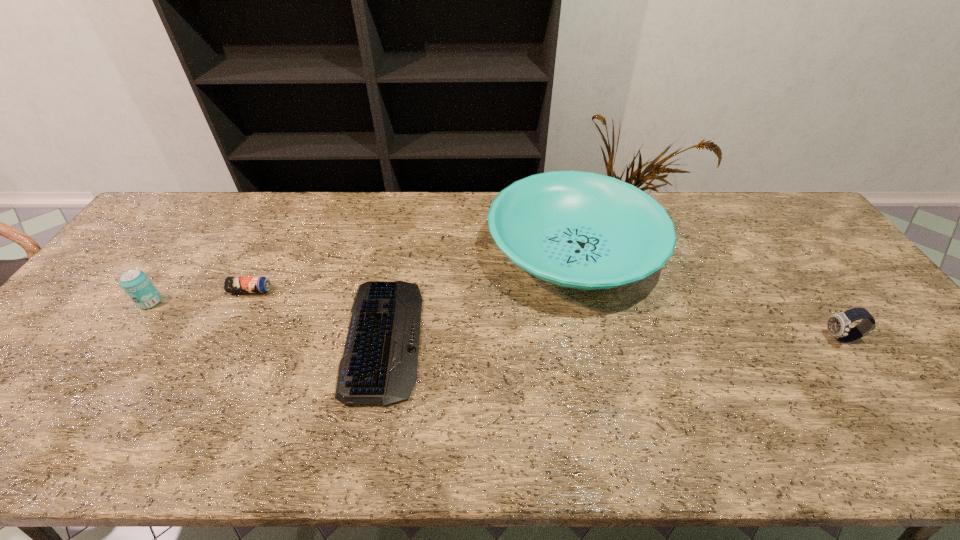
Locate an element on the screen. The height and width of the screenshot is (540, 960). dish is located at coordinates (582, 230).

This screenshot has width=960, height=540. Identify the location of the fourth object from left to right. (582, 230).

Where is `the left beer can`? The width and height of the screenshot is (960, 540). the left beer can is located at coordinates (136, 284).

Identify the location of the taller beer can. This screenshot has height=540, width=960. (136, 284).

Where is `watch`? watch is located at coordinates (838, 324).

Where is `the right beer can`? the right beer can is located at coordinates (231, 284).

Identify the location of the second object from left to right. (231, 284).

Where is `the third object from left to right`? Image resolution: width=960 pixels, height=540 pixels. the third object from left to right is located at coordinates (379, 365).

Locate an element on the screen. the shortest object is located at coordinates (379, 365).

The width and height of the screenshot is (960, 540). I want to click on free space located on the left of the dish, so click(422, 252).